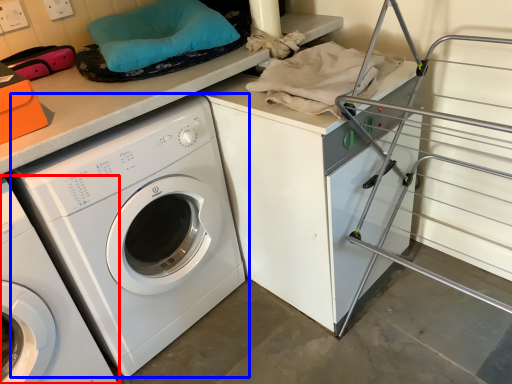
Question: Among these objects, which one is farthest to the camera, washing machine (highlighted by a red box) or washing machine (highlighted by a blue box)?

Choices:
 (A) washing machine
 (B) washing machine

Answer: (B)